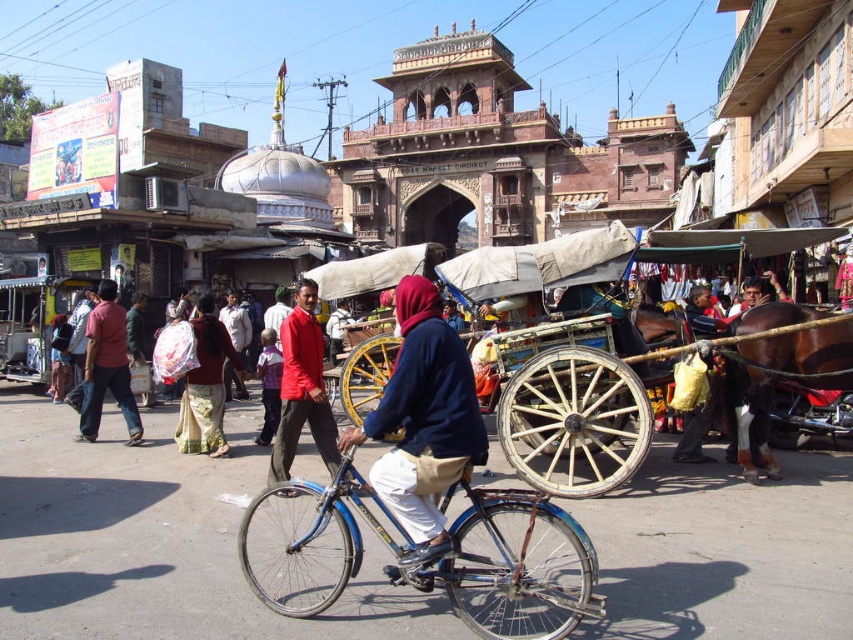
Does blue fabric at center lie in front of matte red saree at center?

Yes.

Does blue fabric at center have a smaller size compared to matte red saree at center?

No.

I want to click on blue fabric at center, so pos(422,420).

Is matte red saree at center bigger than red fabric headscarf at center?

Indeed, matte red saree at center has a larger size compared to red fabric headscarf at center.

Is matte red saree at center further to the viewer compared to red fabric headscarf at center?

No, matte red saree at center is closer to the viewer.

Is point (210, 380) positioned behind point (260, 444)?

No.

Where is `matte red saree at center`? Image resolution: width=853 pixels, height=640 pixels. matte red saree at center is located at coordinates (206, 385).

Is blue metallic bicycle at center above matte red saree at center?

No.

Is blue metallic bicycle at center closer to the viewer compared to matte red saree at center?

Yes, it is in front of matte red saree at center.

Locate an element on the screen. The width and height of the screenshot is (853, 640). blue metallic bicycle at center is located at coordinates (439, 557).